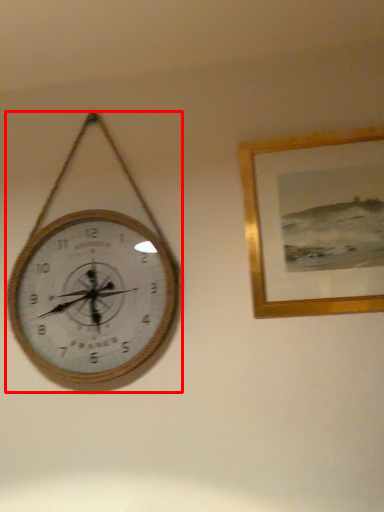
Question: In this image, where is wall clock (annotated by the red box) located relative to picture frame?

Choices:
 (A) right
 (B) left

Answer: (B)